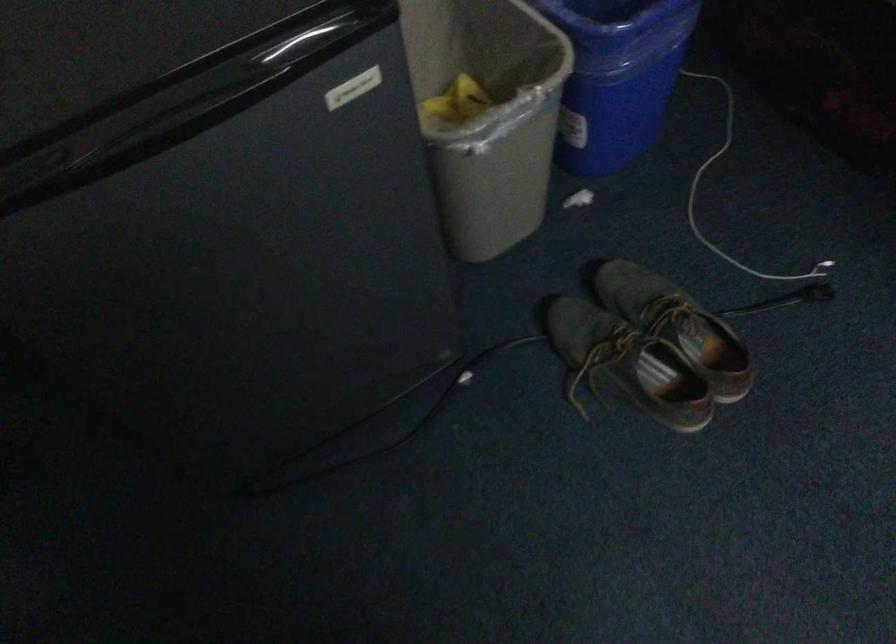
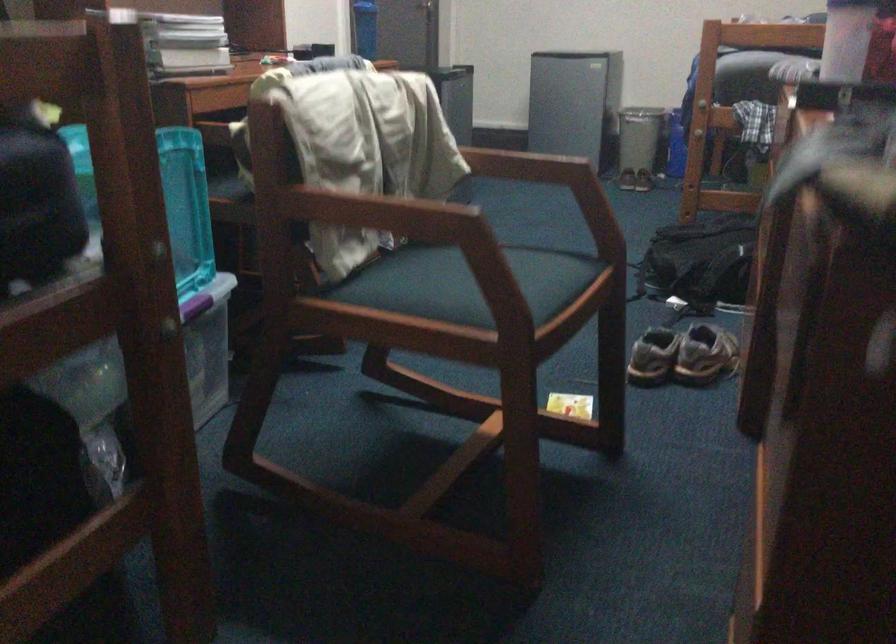
Question: I am providing you with two images of the same scene from different viewpoints. Please identify which objects are invisible in image2.

Choices:
 (A) blue cylinder bottle
 (B) white cable connector
 (C) blue water bottle
 (D) silver trash can

Answer: (B)